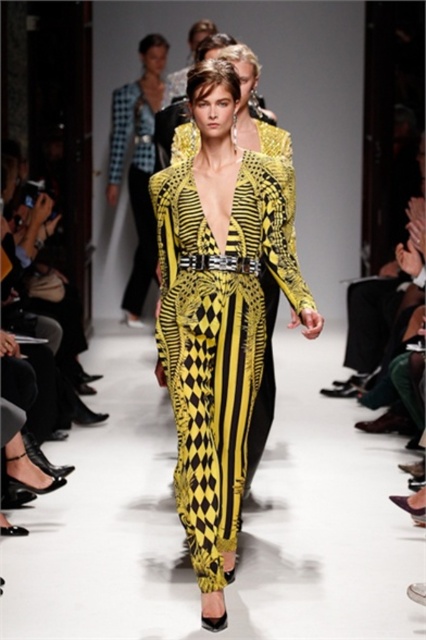
Is yellow printed dress at center above yellow printed jumpsuit at center?

Incorrect, yellow printed dress at center is not positioned above yellow printed jumpsuit at center.

Between yellow printed dress at center and yellow printed jumpsuit at center, which one has less height?

yellow printed dress at center

You are a GUI agent. You are given a task and a screenshot of the screen. Output one action in this format:
    pyautogui.click(x=<x>, y=<y>)
    Task: Click on the yellow printed dress at center
    
    Given the screenshot: What is the action you would take?
    pyautogui.click(x=219, y=332)